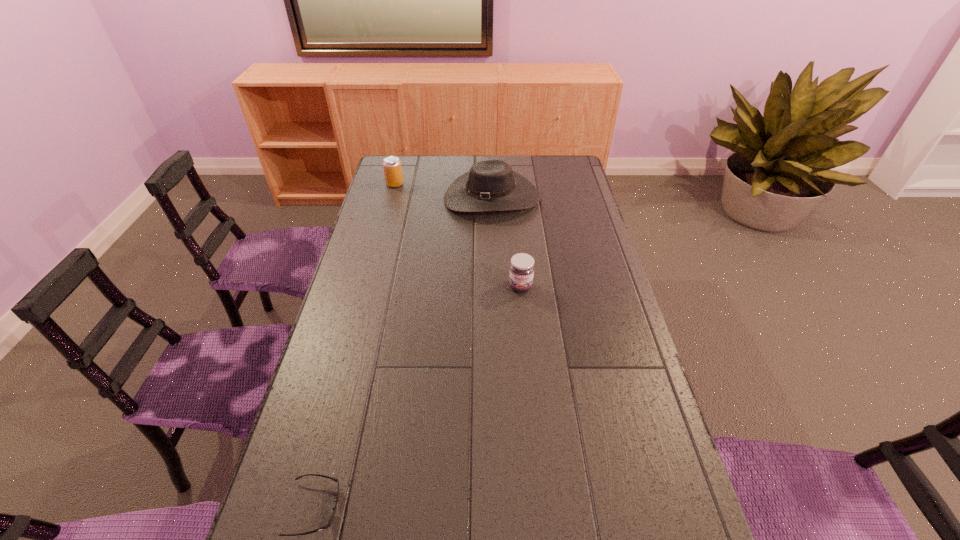
Where is `vacant space that satisfies the following two spatial constraints: 1. on the front label of the jam; 2. on the front-facing side of the shortest object`? The image size is (960, 540). vacant space that satisfies the following two spatial constraints: 1. on the front label of the jam; 2. on the front-facing side of the shortest object is located at coordinates (541, 508).

Locate an element on the screen. vacant position in the image that satisfies the following two spatial constraints: 1. on the front label of the jam; 2. on the front-facing side of the nearest object is located at coordinates (541, 508).

The image size is (960, 540). I want to click on vacant space that satisfies the following two spatial constraints: 1. on the front label of the jam; 2. on the front-facing side of the nearest object, so click(x=541, y=508).

Where is `free space that satisfies the following two spatial constraints: 1. on the front-facing side of the cowboy hat; 2. on the front-facing side of the sunglasses`? The image size is (960, 540). free space that satisfies the following two spatial constraints: 1. on the front-facing side of the cowboy hat; 2. on the front-facing side of the sunglasses is located at coordinates (503, 508).

Where is `free space in the image that satisfies the following two spatial constraints: 1. on the front-facing side of the tallest object; 2. on the front-facing side of the sunglasses`? free space in the image that satisfies the following two spatial constraints: 1. on the front-facing side of the tallest object; 2. on the front-facing side of the sunglasses is located at coordinates (503, 508).

Where is `vacant point that satisfies the following two spatial constraints: 1. on the front label of the jam; 2. on the front-facing side of the nearest object`? The image size is (960, 540). vacant point that satisfies the following two spatial constraints: 1. on the front label of the jam; 2. on the front-facing side of the nearest object is located at coordinates (541, 508).